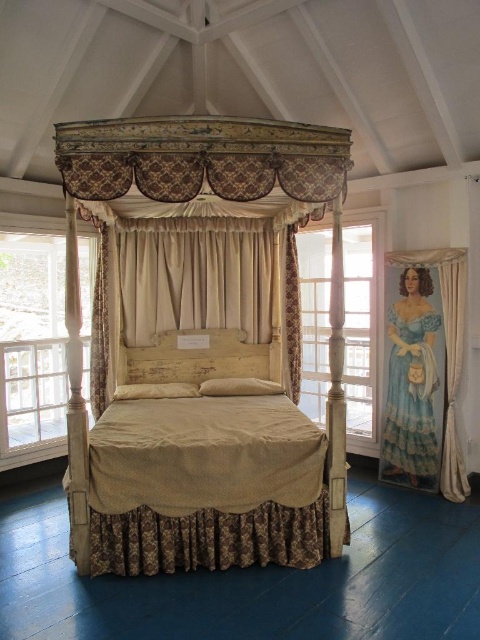
Can you confirm if wooden canopy bed at center is positioned above beige fabric curtain at right?

Correct, wooden canopy bed at center is located above beige fabric curtain at right.

Between point (249, 353) and point (450, 419), which one is positioned in front?

Point (450, 419) is in front.

Between point (249, 400) and point (450, 401), which one is positioned behind?

The point (249, 400) is behind.

I want to click on wooden canopy bed at center, so click(x=201, y=348).

Who is more forward, [11,269] or [397,404]?

Point [397,404] is in front.

Who is more distant from viewer, (39, 240) or (429, 292)?

Point (39, 240)

Measure the distance between white wood window at left and camera.

4.31 meters

Locate an element on the screen. white wood window at left is located at coordinates (32, 348).

This screenshot has height=640, width=480. What are the coordinates of `clear glass window at center` in the screenshot? It's located at (360, 332).

The image size is (480, 640). Find the location of `clear glass window at center`. clear glass window at center is located at coordinates [x=360, y=332].

In order to click on clear glass window at center in this screenshot , I will do `click(360, 332)`.